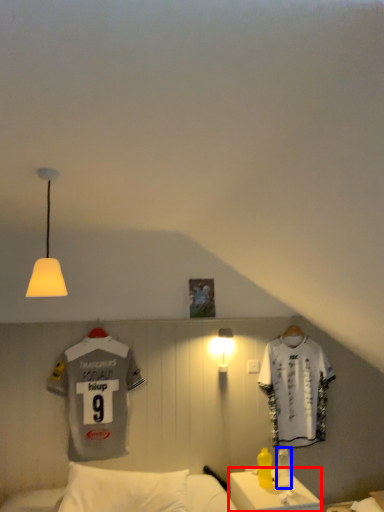
Question: Which object is further to the camera taking this photo, table (highlighted by a red box) or bottle (highlighted by a blue box)?

Choices:
 (A) table
 (B) bottle

Answer: (B)